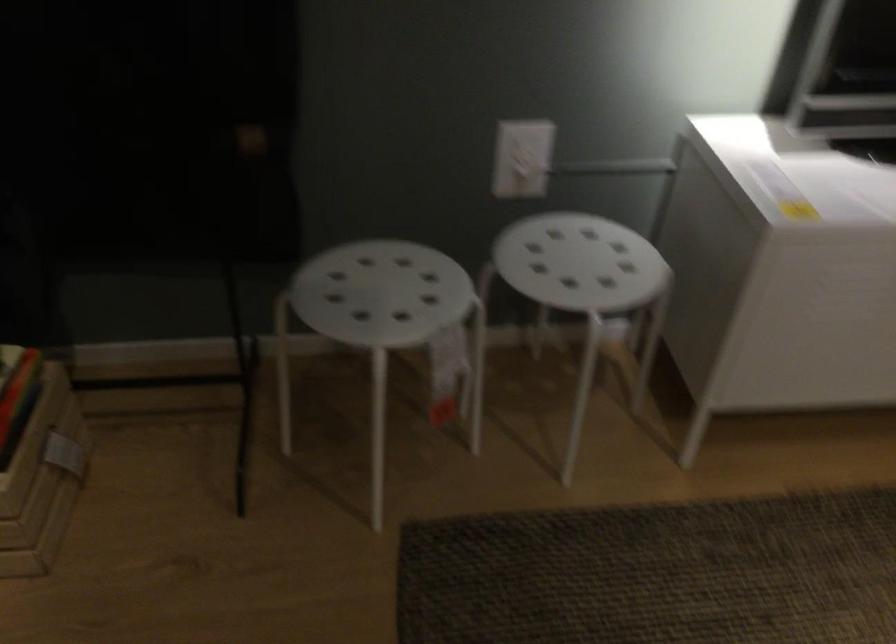
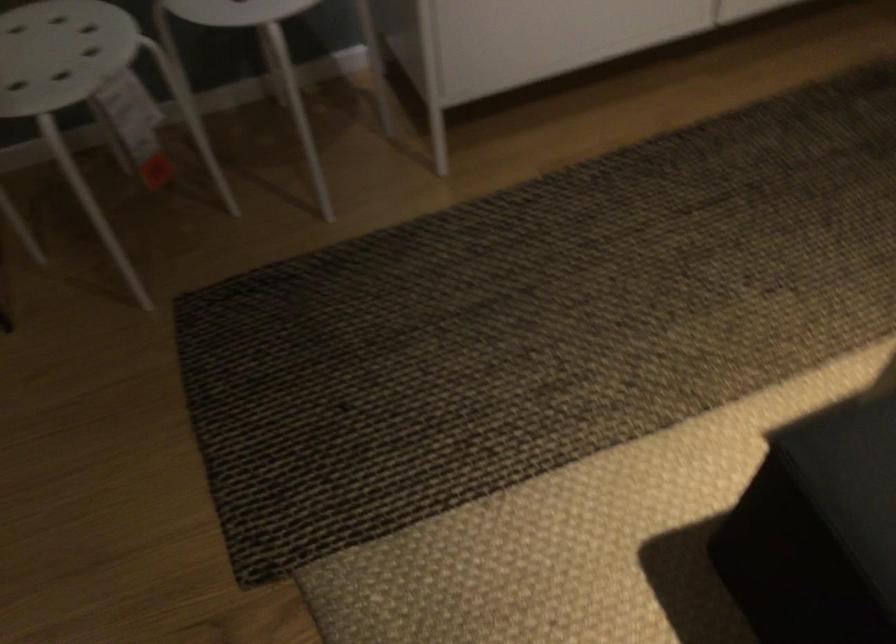
Question: How did the camera likely rotate?

Choices:
 (A) Left
 (B) Right
 (C) Up
 (D) Down

Answer: (D)